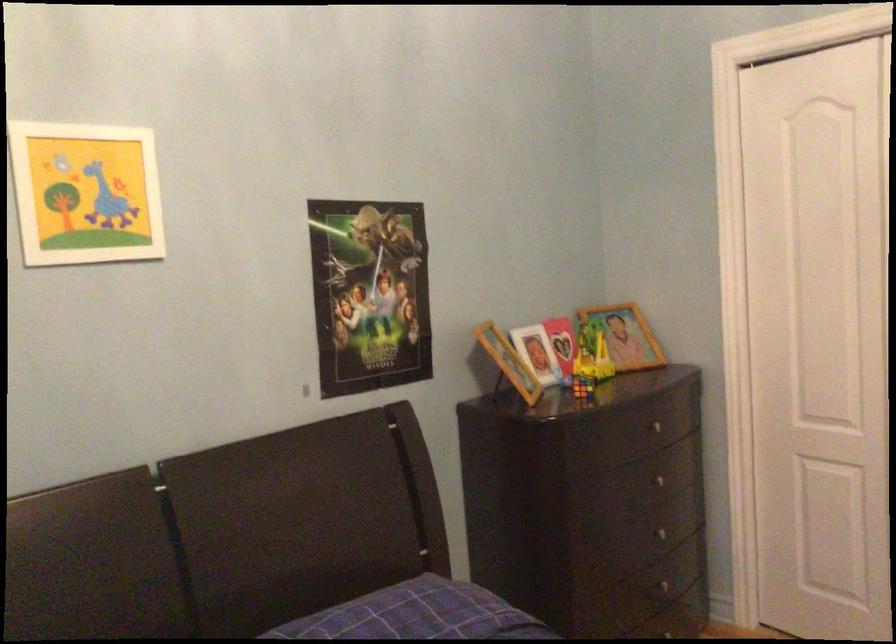
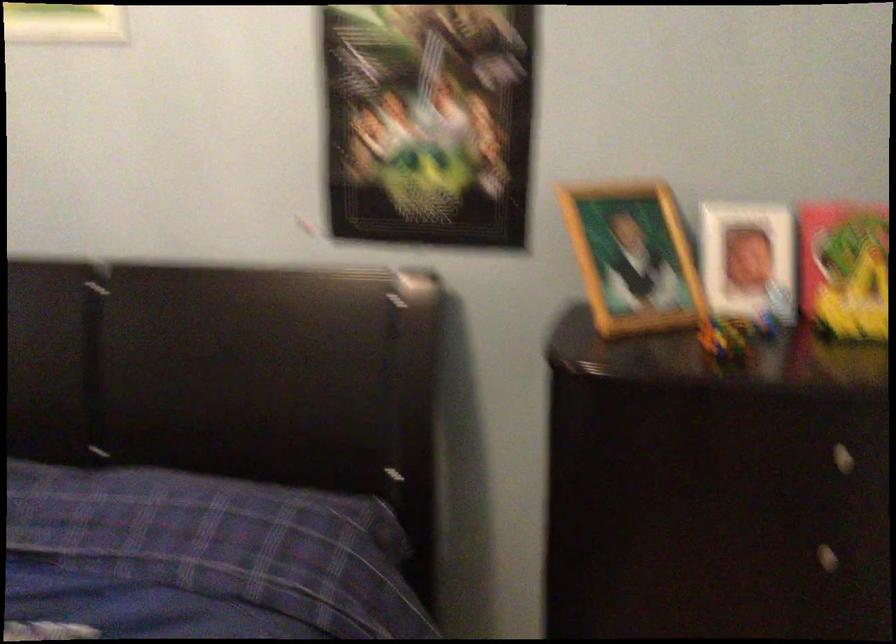
In the second image, find the point that corresponds to (540,354) in the first image.

(748, 261)